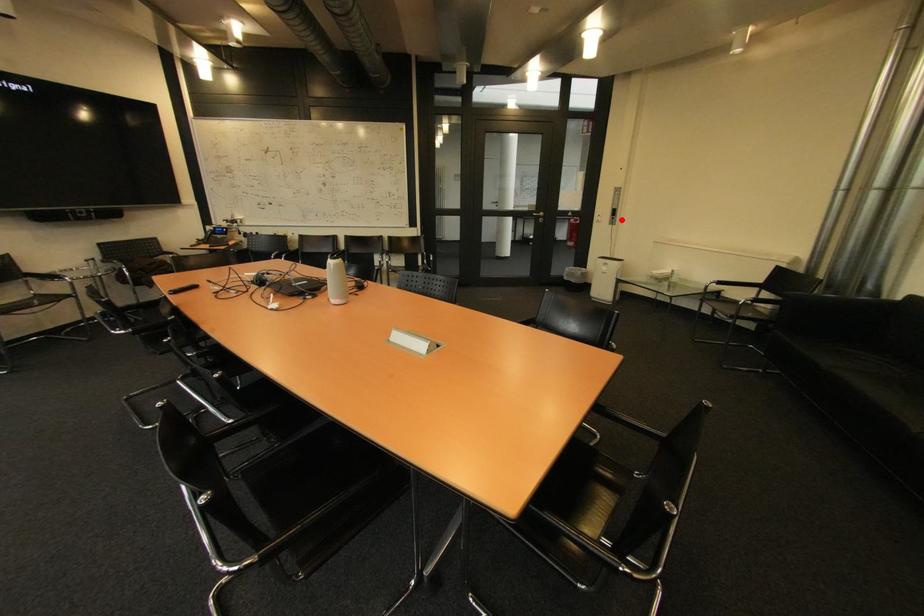
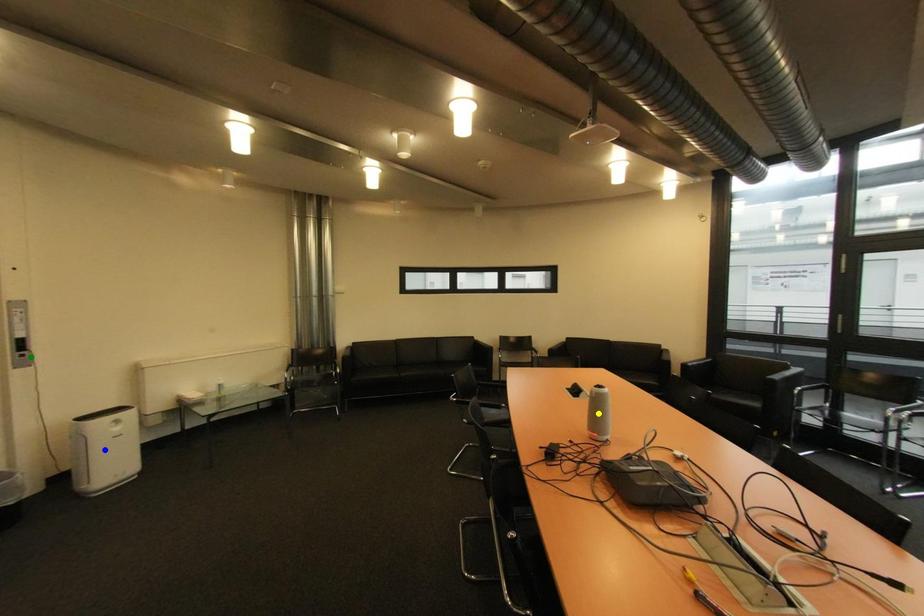
Question: I am providing you with two images of the same scene from different viewpoints. A red point is marked on the first image. You are given multiple points on the second image. Which mark in image 2 goes with the point in image 1?

Choices:
 (A) green point
 (B) blue point
 (C) yellow point

Answer: (A)